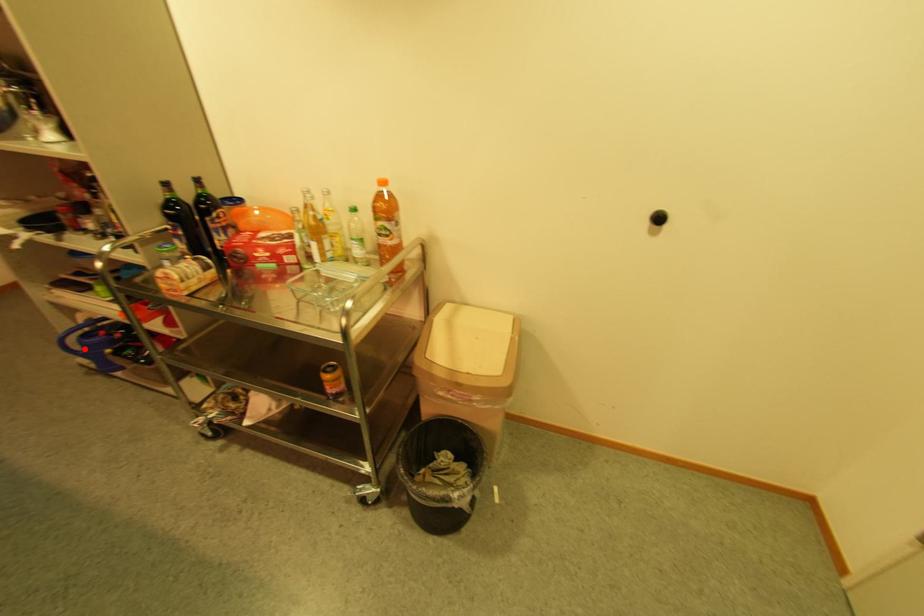
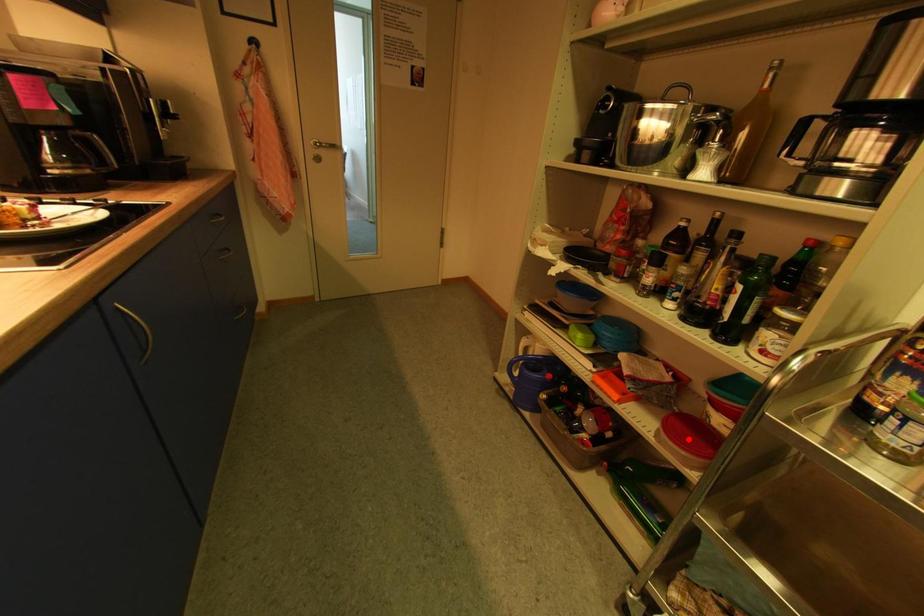
I am providing you with two images of the same scene from different viewpoints. A red point is marked on the first image and another point is marked on the second image. Does the point marked in image1 correspond to the same location as the one in image2?

No